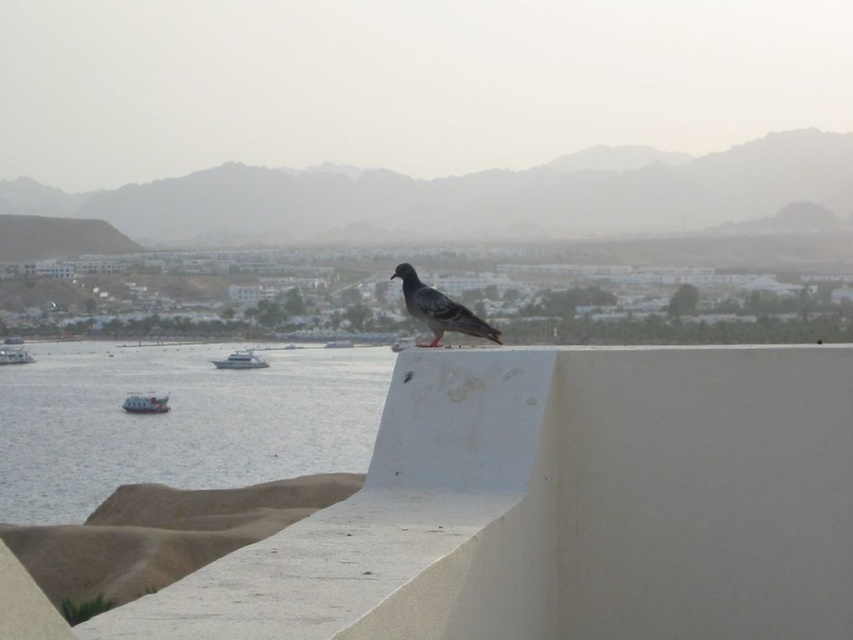
Based on the photo, between white glossy boat at center and white plastic boat at lower left, which one appears on the left side from the viewer's perspective?

Positioned to the left is white plastic boat at lower left.

Can you confirm if white glossy boat at center is thinner than white plastic boat at lower left?

In fact, white glossy boat at center might be wider than white plastic boat at lower left.

This screenshot has height=640, width=853. I want to click on white glossy boat at center, so click(x=241, y=360).

Is gray matte pigeon at center taller than metallic gray boat at lower left?

Yes.

Which is below, gray matte pigeon at center or metallic gray boat at lower left?

Positioned lower is metallic gray boat at lower left.

Describe the element at coordinates (439, 308) in the screenshot. I see `gray matte pigeon at center` at that location.

You are a GUI agent. You are given a task and a screenshot of the screen. Output one action in this format:
    pyautogui.click(x=<x>, y=<y>)
    Task: Click on the gray matte pigeon at center
    Image resolution: width=853 pixels, height=640 pixels.
    Given the screenshot: What is the action you would take?
    pyautogui.click(x=439, y=308)

Who is positioned more to the left, metallic gray boat at lower left or white glossy boat at center?

metallic gray boat at lower left is more to the left.

Between point (163, 404) and point (254, 356), which one is positioned in front?

Point (163, 404)

Identify the location of metallic gray boat at lower left. (144, 403).